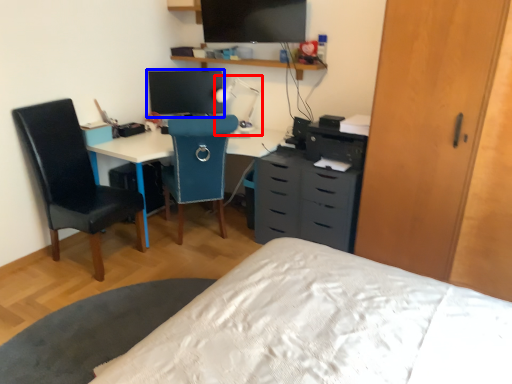
Question: Among these objects, which one is farthest to the camera, table lamp (highlighted by a red box) or computer monitor (highlighted by a blue box)?

Choices:
 (A) table lamp
 (B) computer monitor

Answer: (B)